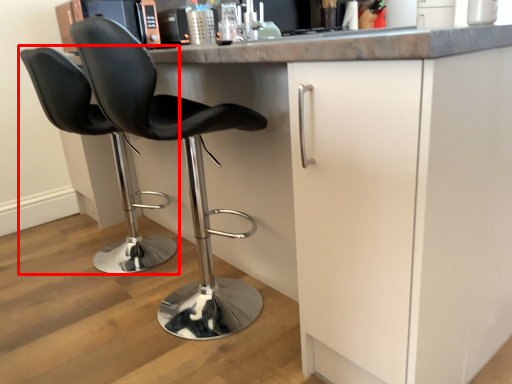
Question: In this image, where is chair (annotated by the red box) located relative to chair?

Choices:
 (A) left
 (B) right

Answer: (A)